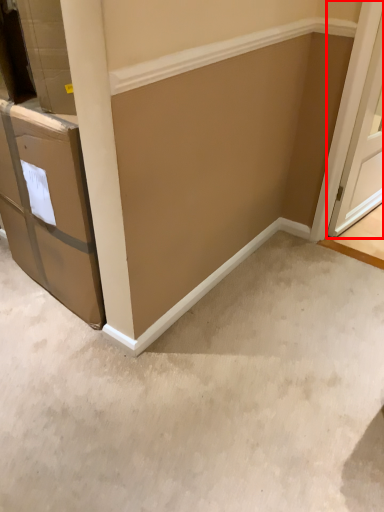
Question: From the image's perspective, what is the correct spatial relationship of door (annotated by the red box) in relation to concrete?

Choices:
 (A) above
 (B) below

Answer: (A)